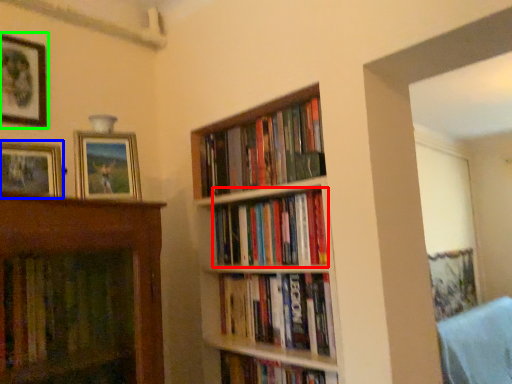
Question: Which object is the closest to the book (highlighted by a red box)? Choose among these: picture frame (highlighted by a blue box) or picture frame (highlighted by a green box).

Choices:
 (A) picture frame
 (B) picture frame

Answer: (A)